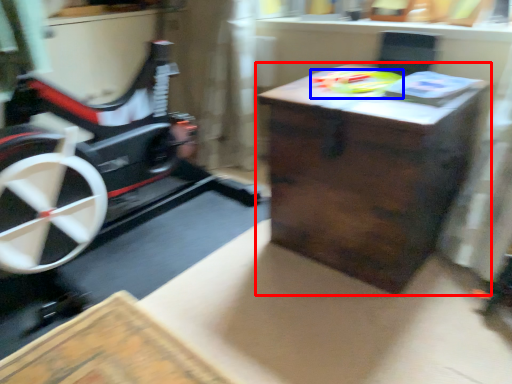
Question: Which point is further to the camera, table (highlighted by a red box) or toy (highlighted by a blue box)?

Choices:
 (A) table
 (B) toy

Answer: (B)